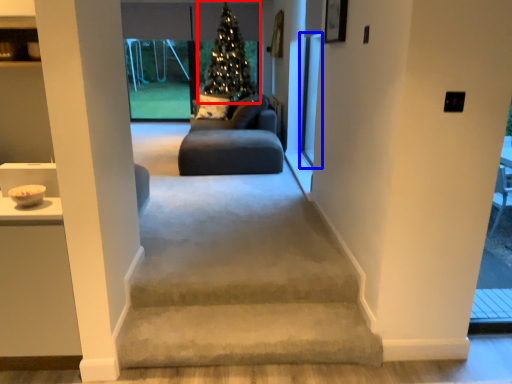
Question: Which object appears closest to the camera in this image, christmas tree (highlighted by a red box) or screen door (highlighted by a blue box)?

Choices:
 (A) christmas tree
 (B) screen door

Answer: (B)